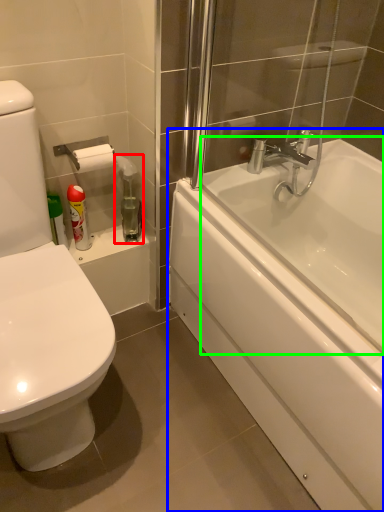
Question: Based on their relative distances, which object is farther from cleaning product (highlighted by a red box)? Choose from bathtub (highlighted by a blue box) and bath (highlighted by a green box).

Choices:
 (A) bathtub
 (B) bath

Answer: (B)